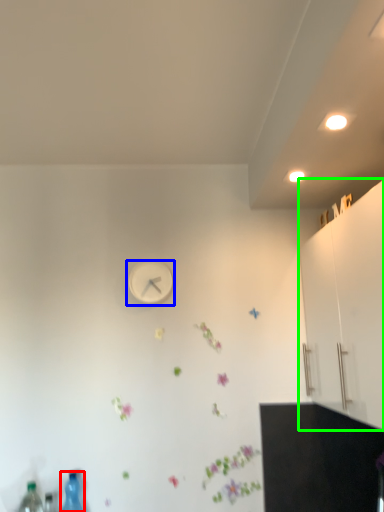
Question: Which object is the closest to the bottle (highlighted by a red box)? Choose among these: wall clock (highlighted by a blue box) or dresser (highlighted by a green box).

Choices:
 (A) wall clock
 (B) dresser

Answer: (A)